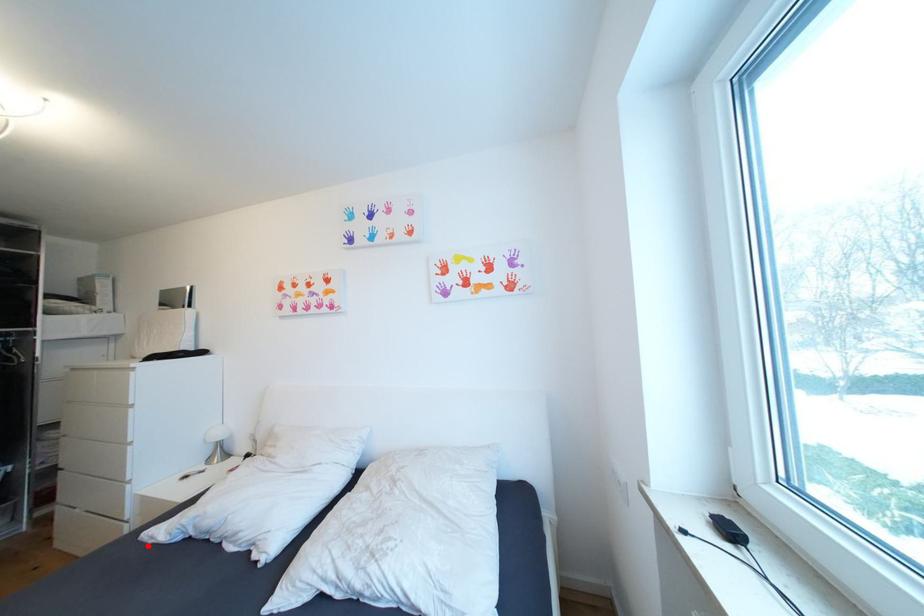
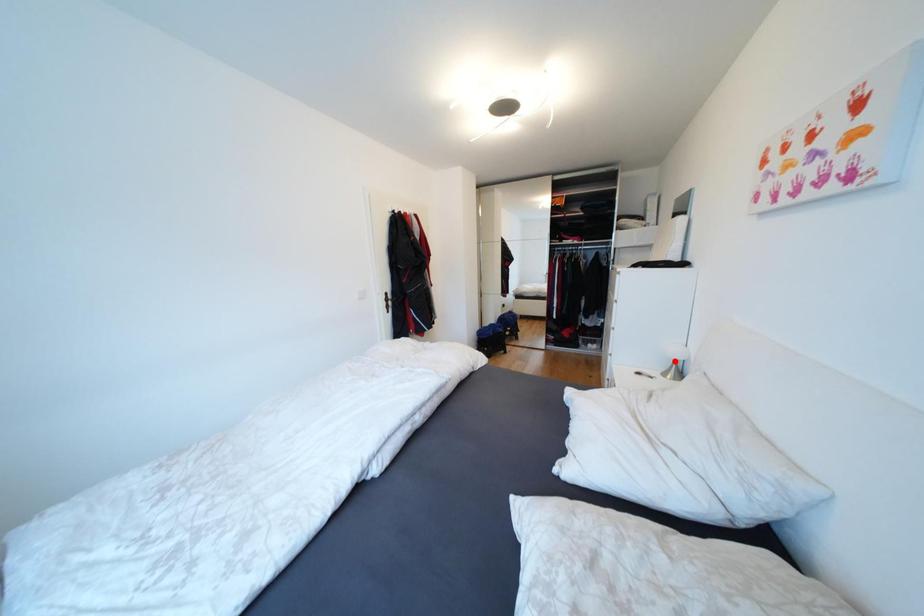
I am providing you with two images of the same scene from different viewpoints. A red point is marked on the first image and another point is marked on the second image. Are the points marked in image1 and image2 representing the same 3D position?

No